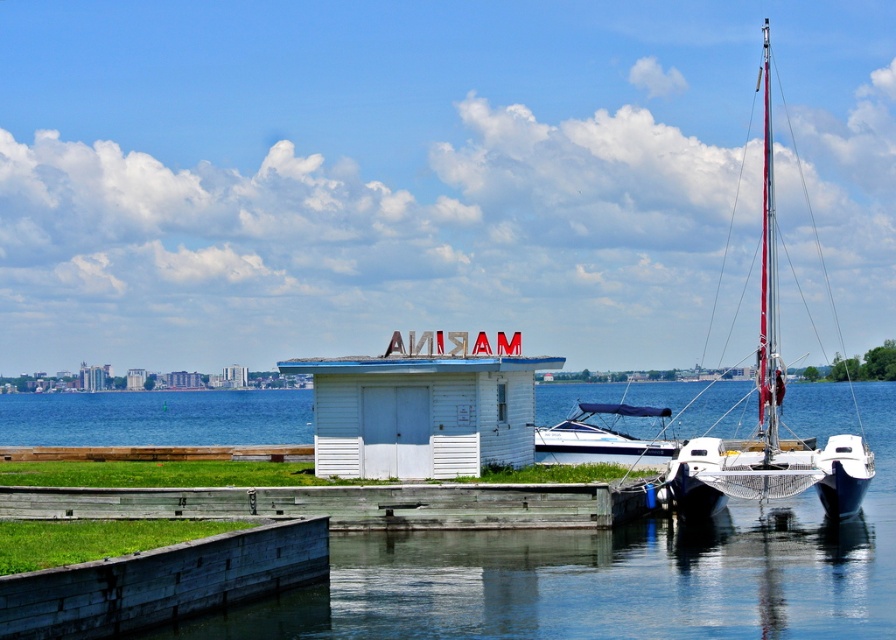
You are planning to walk from the wooden dock at lower center to the metallic silver sailboat at right. Based on the scene description, which object takes up more space in the image?

The metallic silver sailboat at right takes up more space in the image than the wooden dock at lower center because the wooden dock at lower center occupies less space than metallic silver sailboat at right.

You are standing at the marina building and want to reach the blue water at lower left. Which direction should you head towards?

The blue water at lower left is located at point (157, 417), so you should head towards the lower left direction from the marina building to reach it.